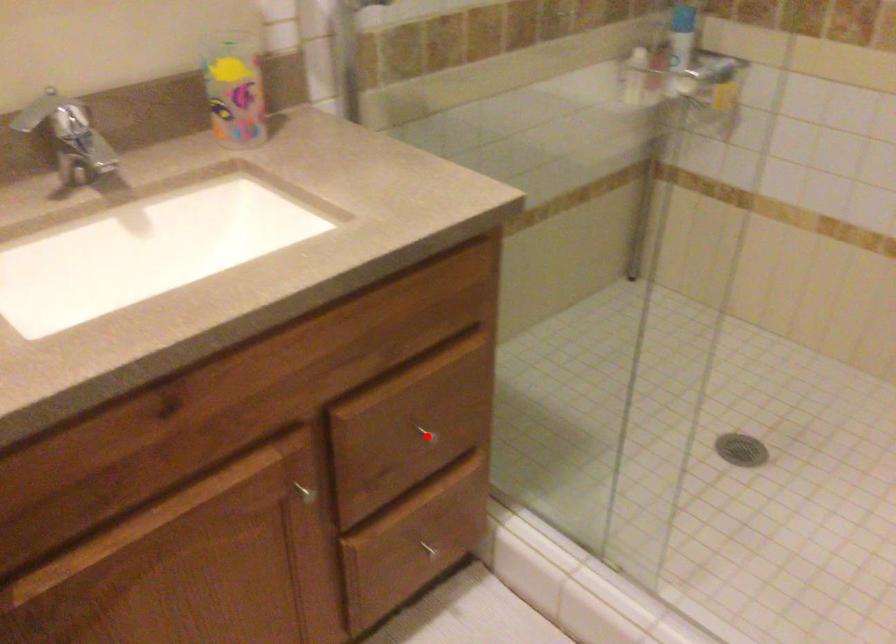
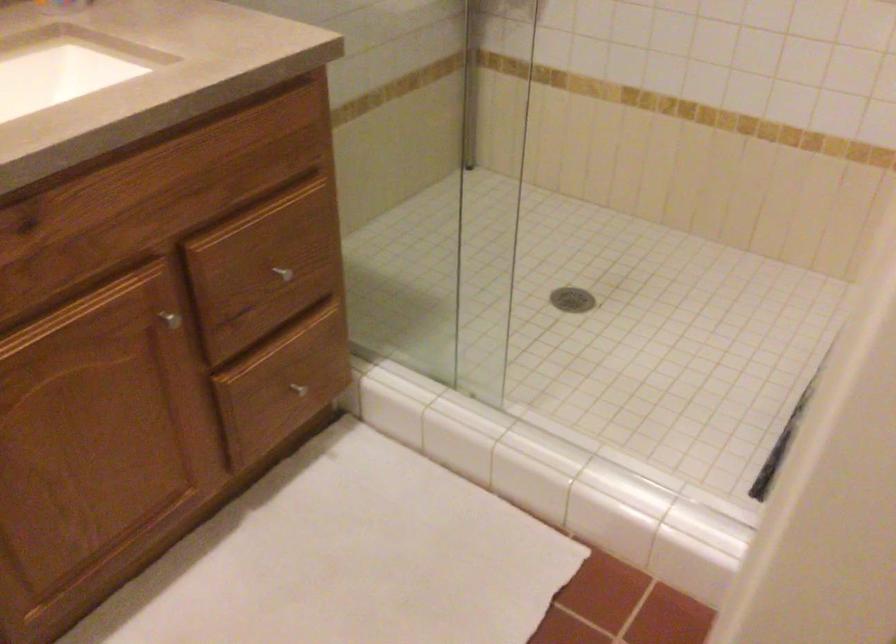
The point at the highlighted location is marked in the first image. Where is the corresponding point in the second image?

(281, 272)